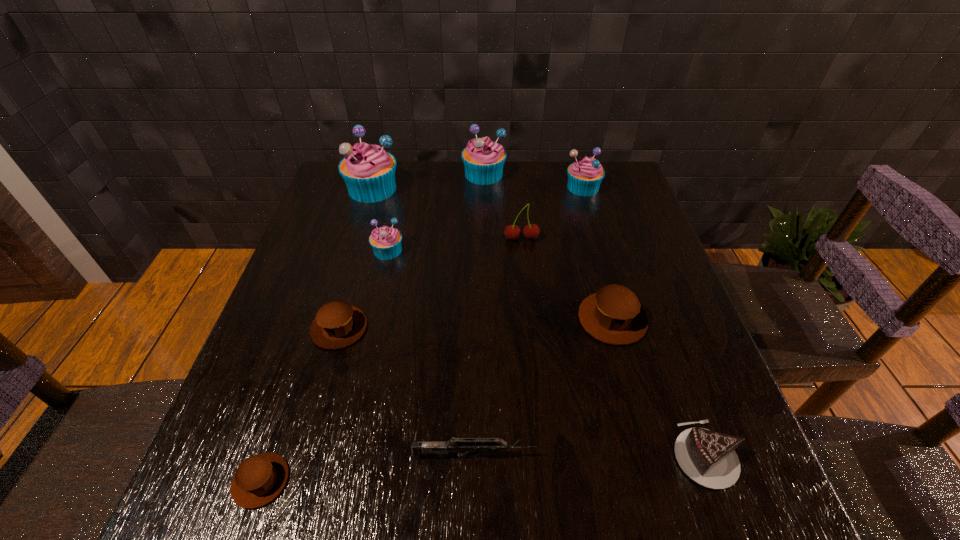
Where is `the biggest blue muffin`? This screenshot has height=540, width=960. the biggest blue muffin is located at coordinates click(368, 170).

Image resolution: width=960 pixels, height=540 pixels. In order to click on the tallest muffin in this screenshot , I will do `click(368, 170)`.

Where is `the third blue muffin from left to right`? The image size is (960, 540). the third blue muffin from left to right is located at coordinates (483, 159).

Find the location of a particular element. the ninth shortest object is located at coordinates (483, 159).

Image resolution: width=960 pixels, height=540 pixels. I want to click on the fifth shortest muffin, so click(585, 175).

The height and width of the screenshot is (540, 960). I want to click on the rightmost blue muffin, so click(585, 175).

You are a GUI agent. You are given a task and a screenshot of the screen. Output one action in this format:
    pyautogui.click(x=<x>, y=<y>)
    Task: Click on the cherry
    The height and width of the screenshot is (540, 960).
    Given the screenshot: What is the action you would take?
    pyautogui.click(x=512, y=232)

Identify the location of the nearest blue muffin. (386, 242).

Image resolution: width=960 pixels, height=540 pixels. What are the coordinates of `the fourth nearest muffin` in the screenshot? It's located at (386, 242).

At what (x,y) coordinates should I click in order to perform the action: click on the biggest brown muffin. Please return your answer as a coordinate pair (x, y). The height and width of the screenshot is (540, 960). Looking at the image, I should click on (613, 315).